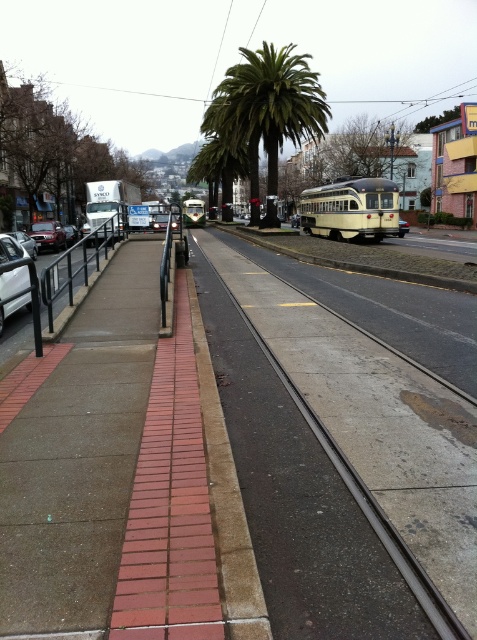
You are standing at point A, which is located at coordinates (341,464). What object is directly beneath your feet?

The concrete track at center is located at point (341,464), so the object directly beneath your feet is the concrete track at center.

You are standing at point (227,500) on the sidewalk. What material are you standing on?

The point at (227,500) is on brick material.

From the picture: You are a delivery person trying to park your van near the concrete track at center and the shiny silver car at left. Based on the scene, which object takes up less space?

The concrete track at center is smaller than the shiny silver car at left, so it takes up less space.